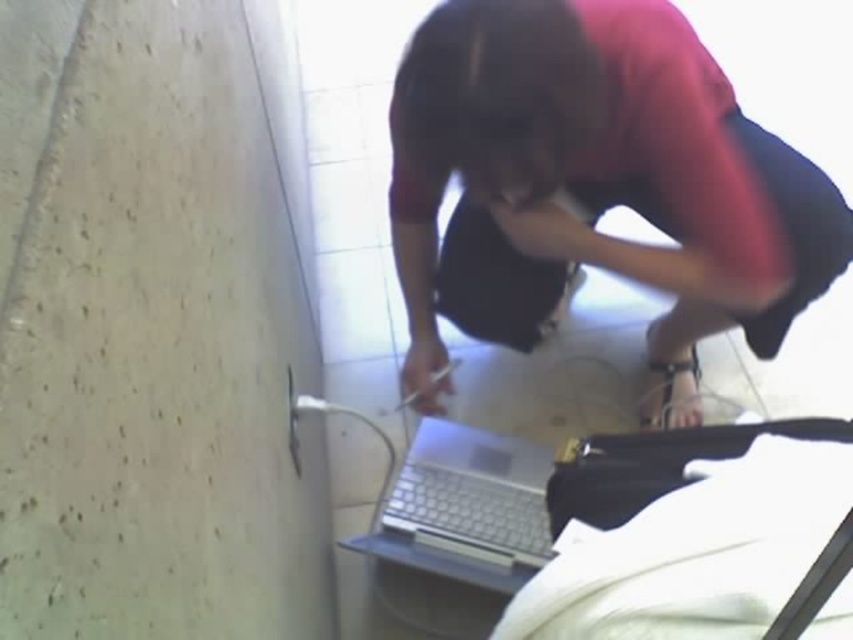
Question: Can you confirm if matte black laptop at lower center is smaller than silver metallic laptop at lower center?

Choices:
 (A) yes
 (B) no

Answer: (B)

Question: Which point is closer to the camera?

Choices:
 (A) silver metallic laptop at lower center
 (B) matte black laptop at lower center

Answer: (B)

Question: Is matte black laptop at lower center to the right of silver metallic laptop at lower center from the viewer's perspective?

Choices:
 (A) no
 (B) yes

Answer: (B)

Question: Is matte black laptop at lower center thinner than silver metallic laptop at lower center?

Choices:
 (A) no
 (B) yes

Answer: (A)